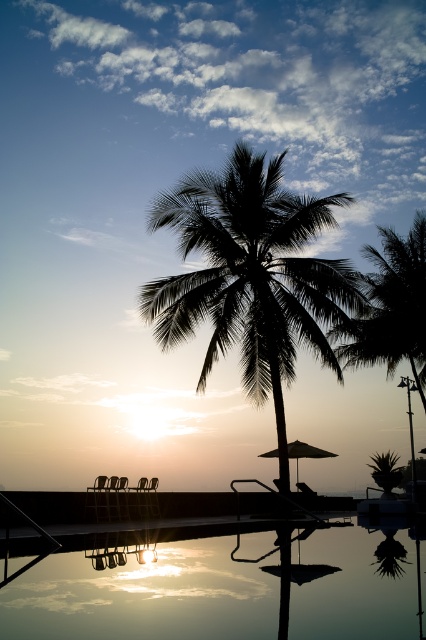
Question: Which is nearer to the matte beige umbrella at center?

Choices:
 (A) silhouette leafy palm at center
 (B) silhouette wooden beach chair at center
 (C) transparent glass water at lower center
 (D) wooden beach chair at lower left

Answer: (B)

Question: Does silhouette palm tree at center have a smaller size compared to silhouette leafy palm at center?

Choices:
 (A) yes
 (B) no

Answer: (B)

Question: Which object appears farthest from the camera in this image?

Choices:
 (A) matte beige umbrella at center
 (B) transparent glass water at lower center
 (C) silhouette palm tree at center
 (D) silhouette wooden beach chair at center

Answer: (D)

Question: Does silhouette leafy palm at center come in front of silhouette wooden beach chair at center?

Choices:
 (A) yes
 (B) no

Answer: (A)

Question: Which of the following is the closest to the observer?

Choices:
 (A) (256, 593)
 (B) (397, 353)
 (C) (305, 486)

Answer: (A)

Question: Does silhouette leafy palm at center have a smaller size compared to wooden beach chair at lower left?

Choices:
 (A) no
 (B) yes

Answer: (A)